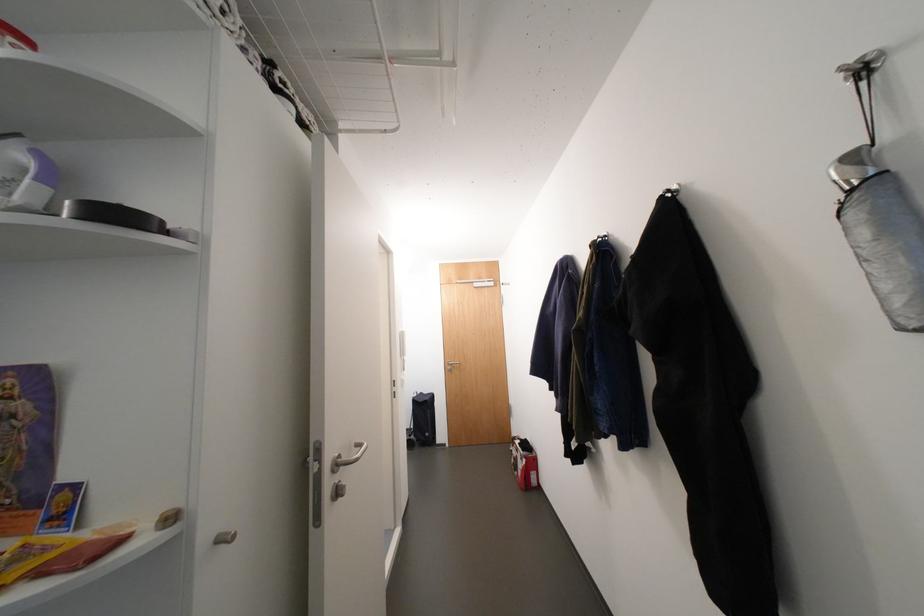
Find where to push the intercom button. Please return your answer as a coordinate pair (x, y).

(337, 490)